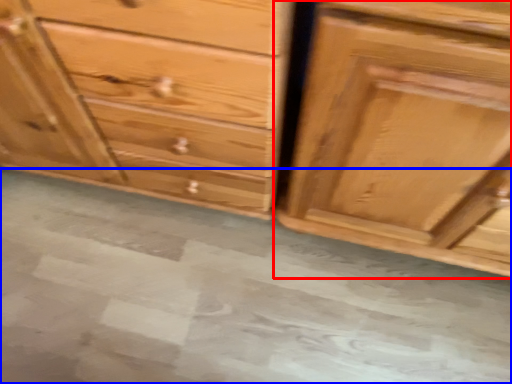
Question: Which object appears farthest to the camera in this image, chest of drawers (highlighted by a red box) or concrete (highlighted by a blue box)?

Choices:
 (A) chest of drawers
 (B) concrete

Answer: (B)